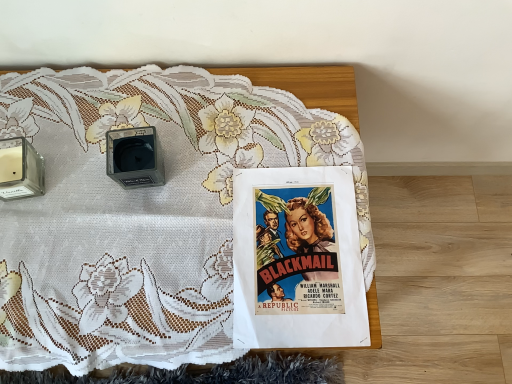
Locate an element on the screen. free location in front of transparent glass candle at left, acting as the first speaker starting from the left is located at coordinates [39, 263].